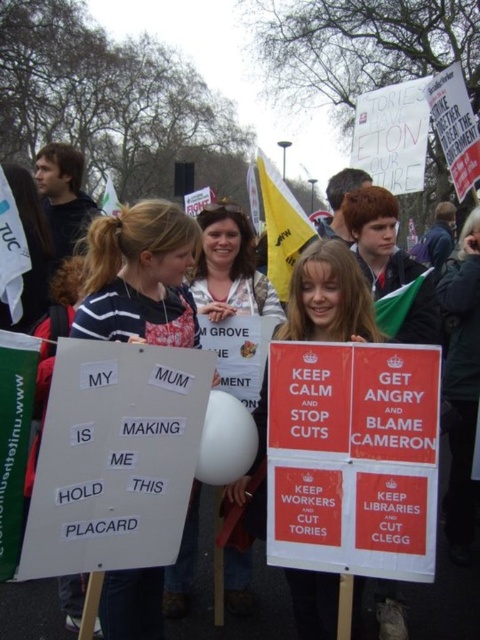
You are a photographer trying to capture both the matte white sign at center and the white paper sign at center in a single frame. Given that your camera can only focus on objects within a 1.2 meter width, will both signs fit in the frame?

The matte white sign at center is narrower than the white paper sign at center. However, since the camera can only focus on objects within a 1.2 meter width, the combined width of both signs must be considered. If their total width exceeds 1.2 meters, they won

You are a photographer trying to capture a clear photo of both the white paper placard at center and the white paper sign at center. Which one will appear closer to the camera in the photo?

The white paper placard at center will appear closer to the camera because it is in front of the white paper sign at center.

You are a photographer trying to capture both the matte white sign at center and the white paper sign at center in a single frame. Given their heights, which sign will appear smaller in your photo?

The matte white sign at center appears smaller in the photo because it has a lesser height compared to the white paper sign at center.